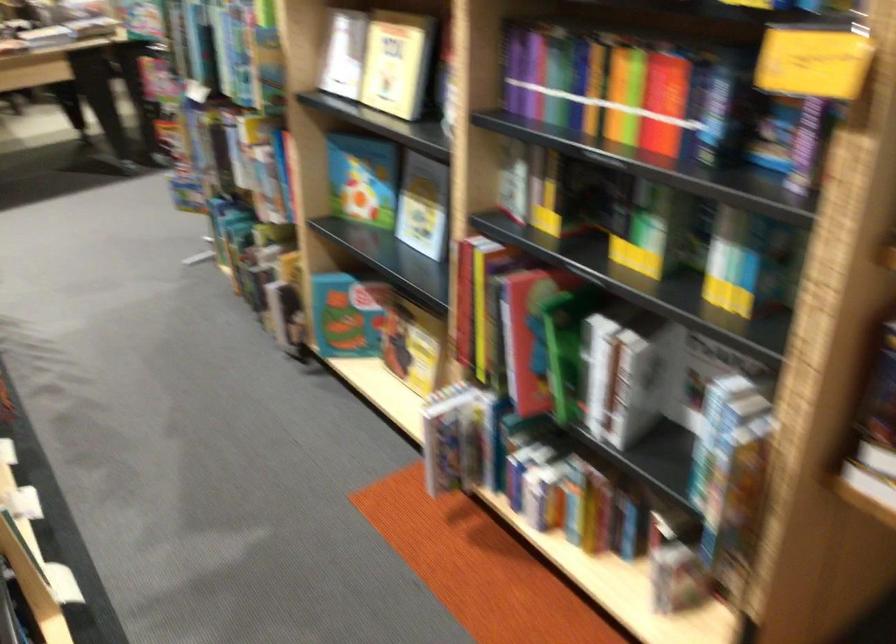
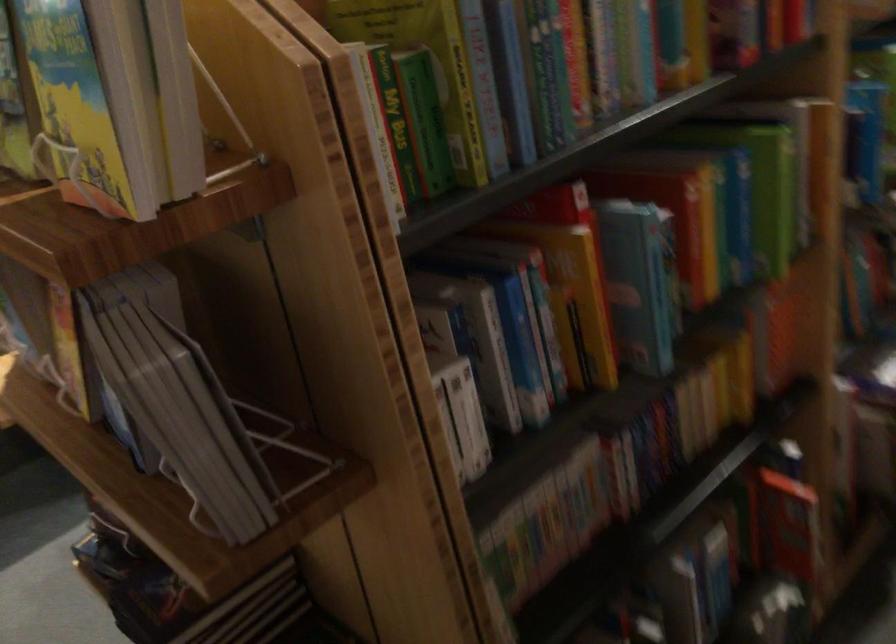
Question: I am providing you with two images of the same scene from different viewpoints. Which of the following objects are not visible in image2?

Choices:
 (A) desk height button
 (B) stacked grey books
 (C) green spine book
 (D) yellow covered book

Answer: (D)